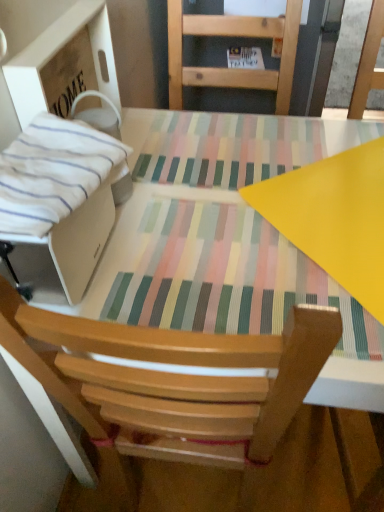
Question: Considering the relative sizes of white cardboard box at left and white striped fabric at left in the image provided, is white cardboard box at left smaller than white striped fabric at left?

Choices:
 (A) no
 (B) yes

Answer: (A)

Question: Is white cardboard box at left not within white striped fabric at left?

Choices:
 (A) yes
 (B) no

Answer: (A)

Question: From the image's perspective, is white cardboard box at left located beneath white striped fabric at left?

Choices:
 (A) yes
 (B) no

Answer: (B)

Question: Does white cardboard box at left lie behind white striped fabric at left?

Choices:
 (A) yes
 (B) no

Answer: (A)

Question: Does white cardboard box at left appear on the right side of white striped fabric at left?

Choices:
 (A) no
 (B) yes

Answer: (A)

Question: Is white cardboard box at left bigger than white striped fabric at left?

Choices:
 (A) no
 (B) yes

Answer: (B)

Question: From the image's perspective, is white striped fabric at left located beneath matte plastic table at center?

Choices:
 (A) no
 (B) yes

Answer: (A)

Question: Can matte plastic table at center be found inside white striped fabric at left?

Choices:
 (A) no
 (B) yes

Answer: (A)

Question: Is white striped fabric at left oriented towards matte plastic table at center?

Choices:
 (A) no
 (B) yes

Answer: (A)

Question: From the image's perspective, is white striped fabric at left over matte plastic table at center?

Choices:
 (A) no
 (B) yes

Answer: (B)

Question: Does white striped fabric at left have a greater height compared to matte plastic table at center?

Choices:
 (A) yes
 (B) no

Answer: (B)

Question: Is white striped fabric at left at the left side of matte plastic table at center?

Choices:
 (A) no
 (B) yes

Answer: (B)

Question: Is matte plastic table at center oriented away from white cardboard box at left?

Choices:
 (A) no
 (B) yes

Answer: (A)